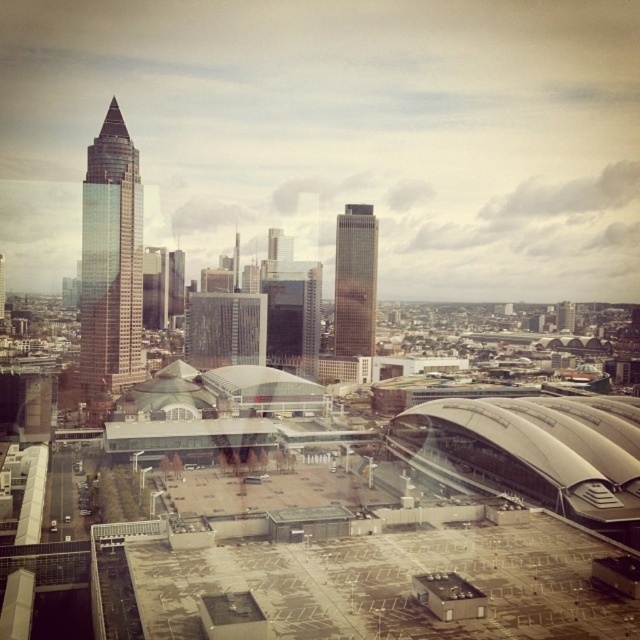
You are an architect evaluating the urban skyline. You need to determine which of the two skyscrapers, the shiny glass skyscraper at left or the gold reflective skyscraper at center, has a greater height. Based on the scene, which one is taller?

The shiny glass skyscraper at left is much taller than the gold reflective skyscraper at center, so it is the taller one.

From the picture: You are standing in the urban skyline scene. There is a point at coordinates point [118,284]. Can you tell me how far this point is from your current position?

The point [118,284] is 311.69 meters away from the viewer.

You are an architect evaluating the urban skyline. Which of the two skyscrapers, the shiny glass skyscraper at left or the gold reflective skyscraper at center, would you say is bigger in size?

The shiny glass skyscraper at left is larger in size compared to the gold reflective skyscraper at center.